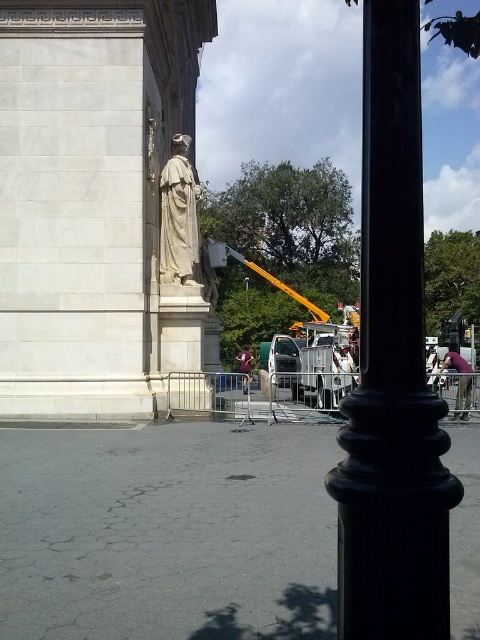
Question: Which point is farther to the camera?

Choices:
 (A) white stone statue at center
 (B) matte black jacket at lower right

Answer: (A)

Question: Can you confirm if matte black jacket at lower right is wider than green fabric jacket at center?

Choices:
 (A) no
 (B) yes

Answer: (A)

Question: Does matte black jacket at lower right appear on the right side of green fabric jacket at center?

Choices:
 (A) no
 (B) yes

Answer: (B)

Question: Which of the following is the farthest from the observer?

Choices:
 (A) white stone statue at center
 (B) black polished pole at center
 (C) matte black jacket at lower right

Answer: (A)

Question: Considering the relative positions of black polished pole at center and green fabric jacket at center in the image provided, where is black polished pole at center located with respect to green fabric jacket at center?

Choices:
 (A) below
 (B) above

Answer: (B)

Question: Which of these objects is positioned farthest from the green fabric jacket at center?

Choices:
 (A) white stone statue at center
 (B) matte black jacket at lower right
 (C) black polished pole at center

Answer: (B)